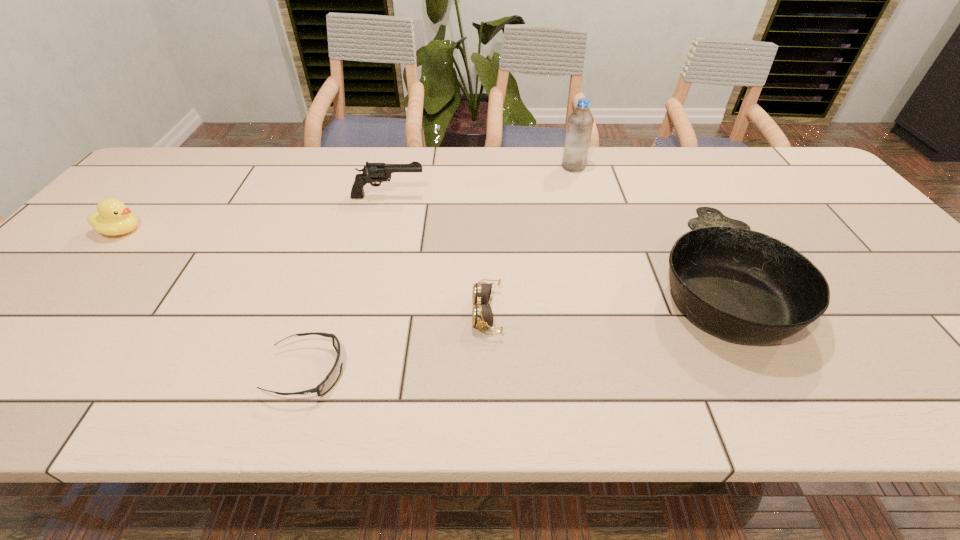
This screenshot has height=540, width=960. I want to click on object at the left edge, so click(113, 218).

I want to click on vacant area at the far edge of the desktop, so click(x=358, y=155).

Find the location of a particular element. vacant space at the near edge is located at coordinates (332, 397).

At what (x,y) coordinates should I click in order to perform the action: click on vacant area at the right edge of the desktop. Please return your answer as a coordinate pair (x, y). Looking at the image, I should click on (826, 201).

At what (x,y) coordinates should I click in order to perform the action: click on vacant space at the far left corner of the desktop. Please return your answer as a coordinate pair (x, y). Image resolution: width=960 pixels, height=540 pixels. Looking at the image, I should click on (197, 147).

Image resolution: width=960 pixels, height=540 pixels. Identify the location of blank space at the far right corner of the desktop. (756, 153).

Image resolution: width=960 pixels, height=540 pixels. I want to click on free spot between the right goggles and the frying pan, so click(603, 299).

You are a GUI agent. You are given a task and a screenshot of the screen. Output one action in this format:
    pyautogui.click(x=<x>, y=<y>)
    Task: Click on the vacant space in between the second farthest object and the left goggles
    
    Given the screenshot: What is the action you would take?
    (x=348, y=284)

This screenshot has width=960, height=540. I want to click on free spot between the second farthest object and the leftmost object, so click(x=255, y=214).

In order to click on free space between the fifth object from left to right and the duckling in this screenshot , I will do `click(348, 199)`.